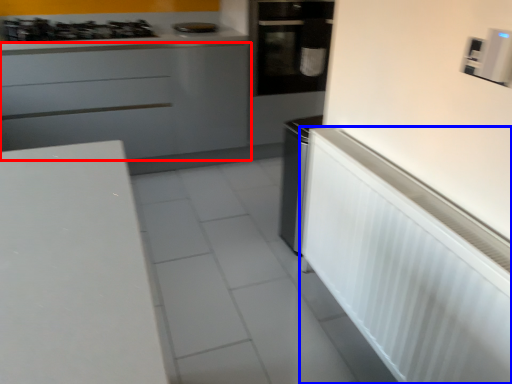
Question: Which object appears farthest to the camera in this image, cabinetry (highlighted by a red box) or appliance (highlighted by a blue box)?

Choices:
 (A) cabinetry
 (B) appliance

Answer: (A)